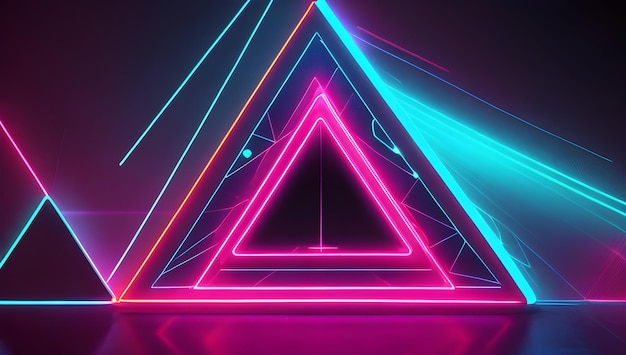
Identify the location of horizontal surface. This screenshot has height=355, width=626. (598, 300).